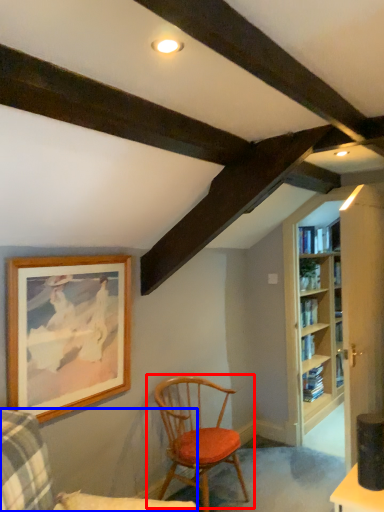
Question: Which object is closer to the camera taking this photo, chair (highlighted by a red box) or chair (highlighted by a blue box)?

Choices:
 (A) chair
 (B) chair

Answer: (B)